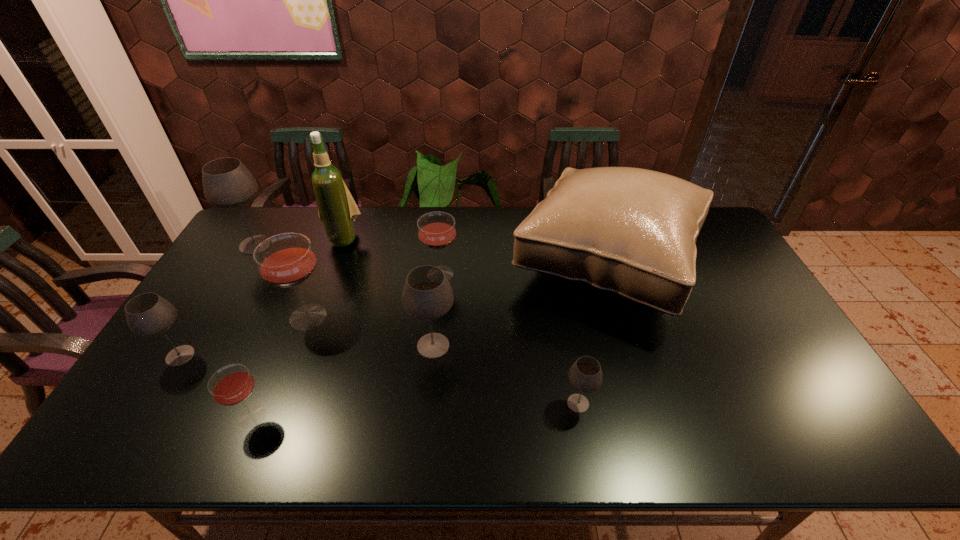
This screenshot has height=540, width=960. I want to click on the nearest gray wineglass, so click(585, 375).

I want to click on the rightmost wineglass, so click(x=585, y=375).

The image size is (960, 540). In order to click on vacant space located on the front-facing side of the wine bottle in this screenshot , I will do `click(310, 332)`.

At what (x,y) coordinates should I click in order to perform the action: click on free space located 0.090m on the right of the cushion. Please return your answer as a coordinate pair (x, y). This screenshot has height=540, width=960. Looking at the image, I should click on (730, 263).

The height and width of the screenshot is (540, 960). Identify the location of vacant space located 0.280m on the right of the tallest wineglass. (358, 245).

Where is `blank space located on the back of the second nearest red wineglass`? The height and width of the screenshot is (540, 960). blank space located on the back of the second nearest red wineglass is located at coordinates (337, 240).

Where is `free point located 0.270m on the back of the second biggest gray wineglass`? free point located 0.270m on the back of the second biggest gray wineglass is located at coordinates (441, 265).

This screenshot has width=960, height=540. What are the coordinates of `blank space located on the right of the second farthest wineglass` in the screenshot? It's located at (541, 274).

This screenshot has width=960, height=540. What are the coordinates of `free region located on the right of the second smallest gray wineglass` in the screenshot? It's located at (322, 356).

Locate an element on the screen. free spot located 0.320m on the right of the smallest red wineglass is located at coordinates (404, 417).